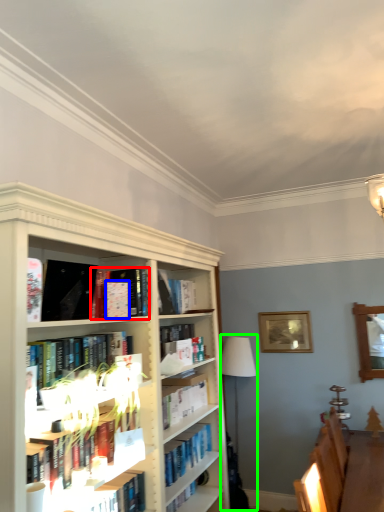
Question: Which object is positioned closest to book (highlighted by a red box)? Select from paperback book (highlighted by a blue box) and lamp (highlighted by a green box).

Choices:
 (A) paperback book
 (B) lamp

Answer: (A)